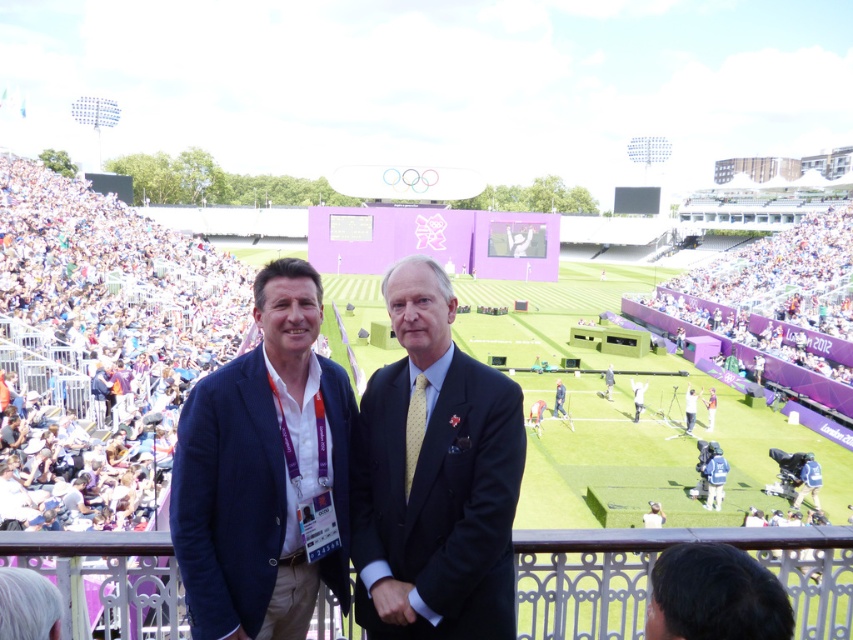
Can you confirm if navy blue suit at center is positioned below light blue suit at center?

Actually, navy blue suit at center is above light blue suit at center.

Between navy blue suit at center and light blue suit at center, which one is positioned higher?

navy blue suit at center

At what (x,y) coordinates should I click in order to perform the action: click on navy blue suit at center. Please return your answer as a coordinate pair (x, y). Image resolution: width=853 pixels, height=640 pixels. Looking at the image, I should click on (263, 472).

Locate an element on the screen. The image size is (853, 640). navy blue suit at center is located at coordinates (263, 472).

At what (x,y) coordinates should I click in order to perform the action: click on multicolored fabric crowd at left. Please return your answer as a coordinate pair (x, y). Looking at the image, I should click on (99, 348).

Does multicolored fabric crowd at left appear on the right side of dark brown hair at lower right?

In fact, multicolored fabric crowd at left is to the left of dark brown hair at lower right.

Is point (64, 397) positioned behind point (711, 634)?

Yes, point (64, 397) is farther from viewer.

Locate an element on the screen. The width and height of the screenshot is (853, 640). multicolored fabric crowd at left is located at coordinates (99, 348).

Which of these two, dark blue suit at center or navy blue suit at center, stands shorter?

With less height is dark blue suit at center.

Does point (393, 385) come in front of point (247, 513)?

That is False.

Locate an element on the screen. The height and width of the screenshot is (640, 853). dark blue suit at center is located at coordinates (433, 477).